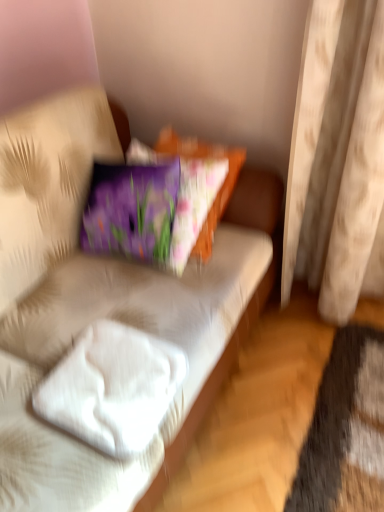
Question: Should I look upward or downward to see white fabric couch at center?

Choices:
 (A) up
 (B) down

Answer: (B)

Question: From a real-world perspective, is white soft pillow at lower left beneath white fabric couch at center?

Choices:
 (A) no
 (B) yes

Answer: (A)

Question: Is the depth of white soft pillow at lower left less than that of white fabric couch at center?

Choices:
 (A) yes
 (B) no

Answer: (A)

Question: Is white soft pillow at lower left facing away from white fabric couch at center?

Choices:
 (A) no
 (B) yes

Answer: (A)

Question: Does white soft pillow at lower left have a lesser height compared to white fabric couch at center?

Choices:
 (A) yes
 (B) no

Answer: (A)

Question: Are white soft pillow at lower left and white fabric couch at center far apart?

Choices:
 (A) no
 (B) yes

Answer: (A)

Question: Would you say white soft pillow at lower left contains white fabric couch at center?

Choices:
 (A) yes
 (B) no

Answer: (B)

Question: Is beige fabric curtain at right thinner than white fabric couch at center?

Choices:
 (A) no
 (B) yes

Answer: (B)

Question: Does beige fabric curtain at right appear on the right side of white fabric couch at center?

Choices:
 (A) yes
 (B) no

Answer: (A)

Question: Is beige fabric curtain at right positioned behind white fabric couch at center?

Choices:
 (A) yes
 (B) no

Answer: (A)

Question: Does beige fabric curtain at right have a smaller size compared to white fabric couch at center?

Choices:
 (A) yes
 (B) no

Answer: (A)

Question: From the image's perspective, does beige fabric curtain at right appear higher than white fabric couch at center?

Choices:
 (A) yes
 (B) no

Answer: (A)

Question: Can you confirm if beige fabric curtain at right is shorter than white fabric couch at center?

Choices:
 (A) yes
 (B) no

Answer: (B)

Question: Can you confirm if white fabric couch at center is taller than white soft pillow at lower left?

Choices:
 (A) no
 (B) yes

Answer: (B)